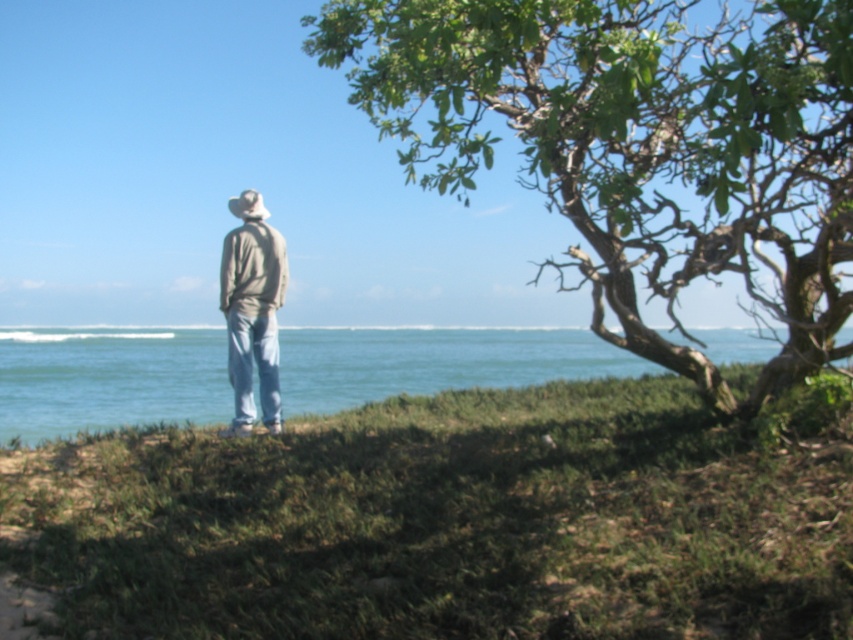
Looking at this image, between blue water at center and light gray cotton jacket at center, which one is positioned higher?

light gray cotton jacket at center

Does blue water at center have a greater width compared to light gray cotton jacket at center?

Yes.

Which is behind, point (473, 381) or point (248, 248)?

Positioned behind is point (473, 381).

Locate an element on the screen. blue water at center is located at coordinates (109, 378).

Is green leafy tree at upper right wider than light gray cotton jacket at center?

No, green leafy tree at upper right is not wider than light gray cotton jacket at center.

Is green leafy tree at upper right in front of light gray cotton jacket at center?

No, it is not.

The width and height of the screenshot is (853, 640). What do you see at coordinates (637, 147) in the screenshot?
I see `green leafy tree at upper right` at bounding box center [637, 147].

At what (x,y) coordinates should I click in order to perform the action: click on green leafy tree at upper right. Please return your answer as a coordinate pair (x, y). Image resolution: width=853 pixels, height=640 pixels. Looking at the image, I should click on (637, 147).

Between point (738, 600) and point (750, 342), which one is positioned behind?

Positioned behind is point (750, 342).

Looking at this image, can you confirm if green grass at lower center is thinner than blue water at center?

No.

Between point (213, 488) and point (84, 340), which one is positioned behind?

The point (84, 340) is behind.

At what (x,y) coordinates should I click in order to perform the action: click on green grass at lower center. Please return your answer as a coordinate pair (x, y). Looking at the image, I should click on (454, 518).